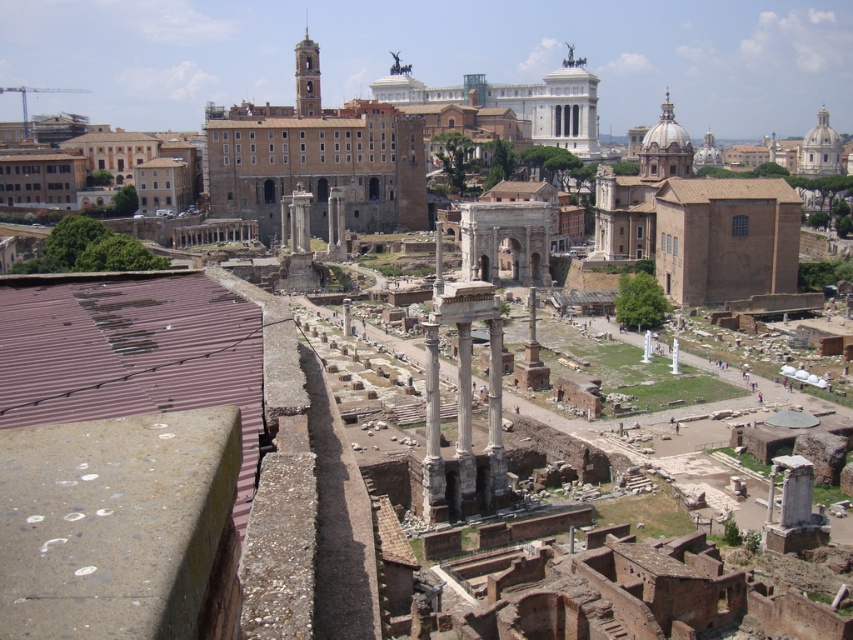
Can you confirm if white stone column at center is wider than white glossy pillar at center?

No, white stone column at center is not wider than white glossy pillar at center.

Can you confirm if white stone column at center is positioned to the left of white glossy pillar at center?

Indeed, white stone column at center is positioned on the left side of white glossy pillar at center.

Is point (460, 506) positioned after point (676, 346)?

No.

What are the coordinates of `white stone column at center` in the screenshot? It's located at (463, 422).

Is white stone column at center behind smooth stone column at center?

No, white stone column at center is closer to the viewer.

You are a GUI agent. You are given a task and a screenshot of the screen. Output one action in this format:
    pyautogui.click(x=<x>, y=<y>)
    Task: Click on the white stone column at center
    The image size is (853, 640).
    Given the screenshot: What is the action you would take?
    click(x=463, y=422)

Can you confirm if white stone column at center is positioned below white marble pillar at center?

Correct, white stone column at center is located below white marble pillar at center.

Can you confirm if white stone column at center is shorter than white marble pillar at center?

In fact, white stone column at center may be taller than white marble pillar at center.

Identify the location of white stone column at center. This screenshot has width=853, height=640. (463, 422).